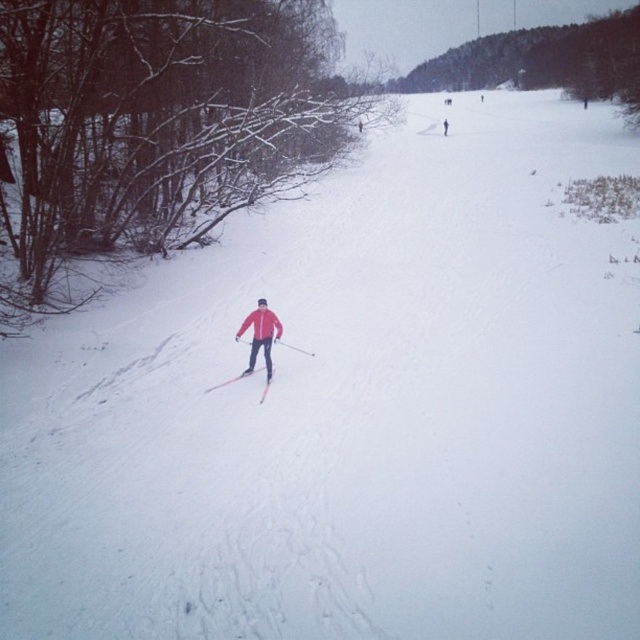
Question: Which of the following is the farthest from the observer?

Choices:
 (A) (515, 77)
 (B) (216, 387)
 (C) (1, 172)

Answer: (A)

Question: Does matte red jacket at center have a smaller size compared to red jacket skier at center?

Choices:
 (A) no
 (B) yes

Answer: (B)

Question: Which object is positioned closest to the matte red jacket at center?

Choices:
 (A) green leafy tree at upper center
 (B) snowy bare branches at left

Answer: (B)

Question: Does green leafy tree at upper center have a lesser width compared to shiny metallic ski at center?

Choices:
 (A) no
 (B) yes

Answer: (A)

Question: Which is farther from the shiny metallic ski at center?

Choices:
 (A) matte red jacket at center
 (B) red jacket skier at center
 (C) green leafy tree at upper center
 (D) snowy bare branches at left

Answer: (C)

Question: Does snowy bare branches at left have a greater width compared to green leafy tree at upper center?

Choices:
 (A) no
 (B) yes

Answer: (A)